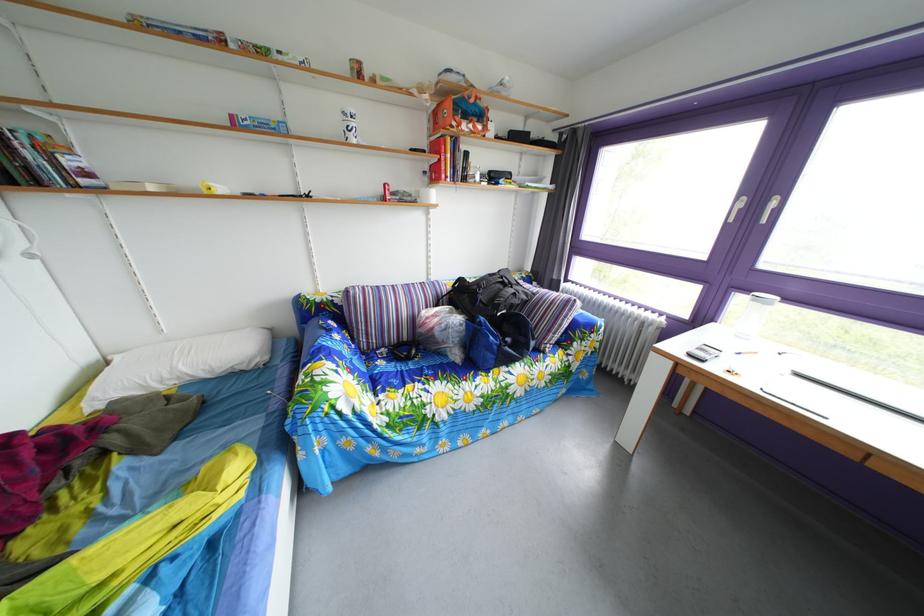
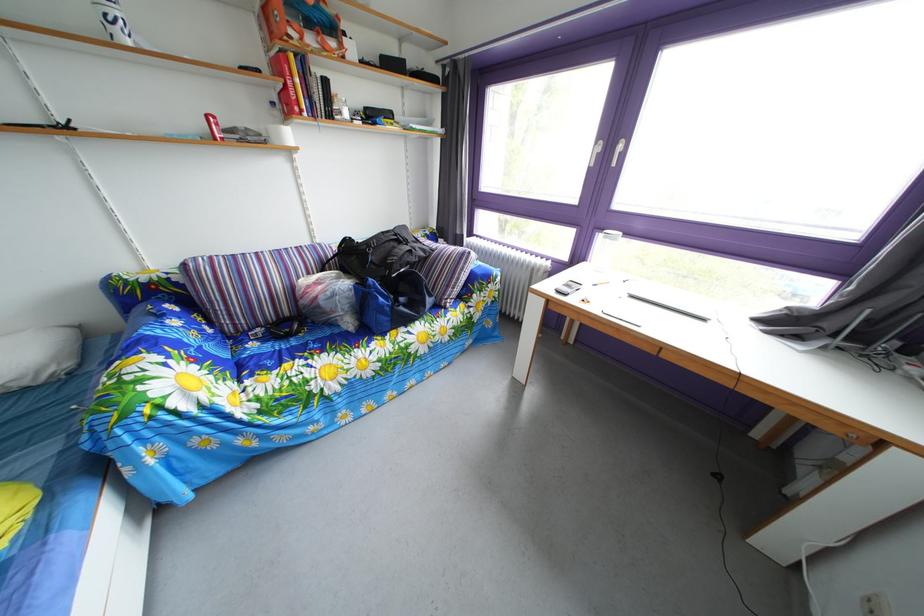
In the second image, find the point that corresponds to [526,302] in the first image.

(421, 260)